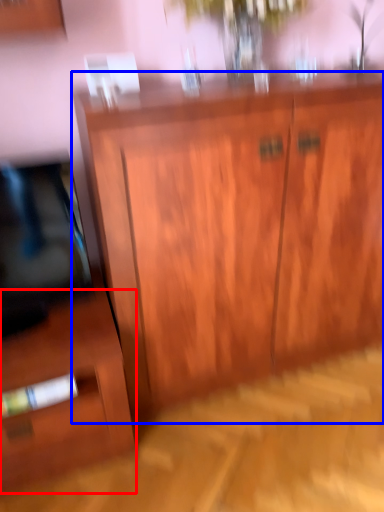
Question: Which object is closer to the camera taking this photo, side cabinet (highlighted by a red box) or cupboard (highlighted by a blue box)?

Choices:
 (A) side cabinet
 (B) cupboard

Answer: (B)